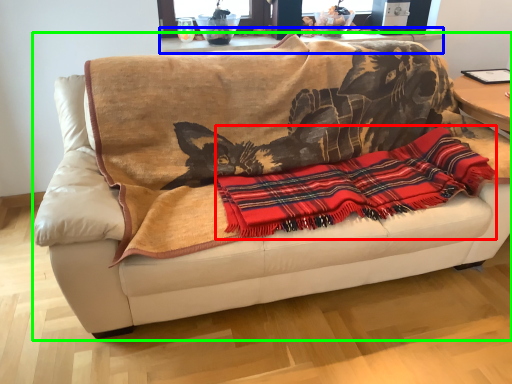
Question: Which is nearer to the cloth (highlighted by a red box)? table (highlighted by a blue box) or studio couch (highlighted by a green box).

Choices:
 (A) table
 (B) studio couch

Answer: (B)